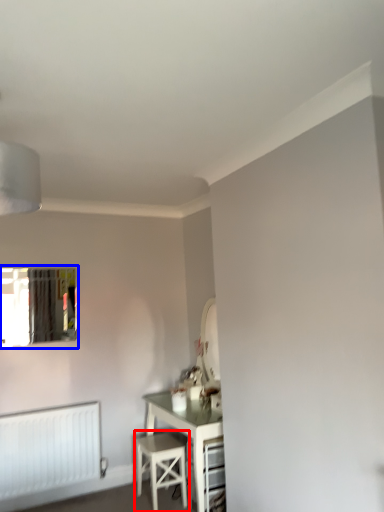
Question: Which of the following is the farthest to the observer, stool (highlighted by a red box) or window (highlighted by a blue box)?

Choices:
 (A) stool
 (B) window

Answer: (B)